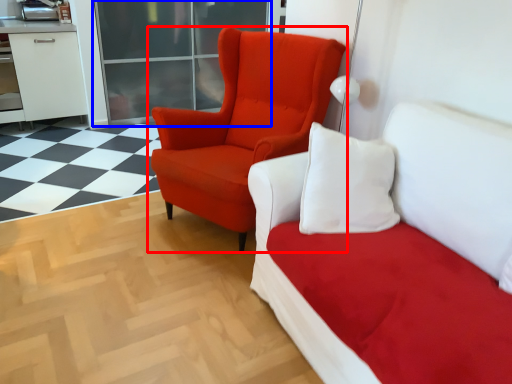
Question: Which object appears farthest to the camera in this image, chair (highlighted by a red box) or glass door (highlighted by a blue box)?

Choices:
 (A) chair
 (B) glass door

Answer: (B)